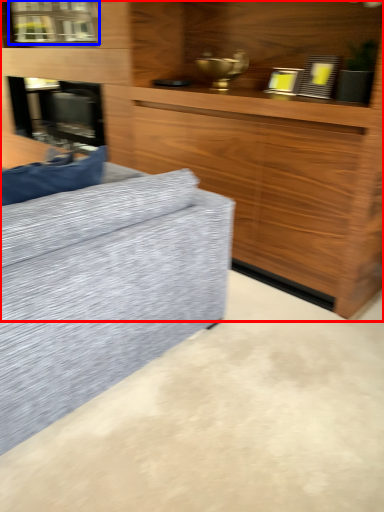
Question: Which point is closer to the camera, cabinetry (highlighted by a red box) or window (highlighted by a blue box)?

Choices:
 (A) cabinetry
 (B) window

Answer: (A)